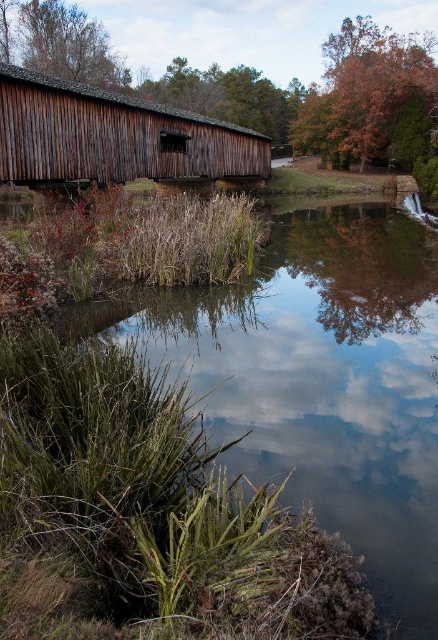
Which of these two, green grassy water at lower left or wooden bridge at left, stands taller?

wooden bridge at left is taller.

Does green grassy water at lower left have a greater height compared to wooden bridge at left?

In fact, green grassy water at lower left may be shorter than wooden bridge at left.

What do you see at coordinates (320, 381) in the screenshot? The width and height of the screenshot is (438, 640). I see `green grassy water at lower left` at bounding box center [320, 381].

Where is `green grassy water at lower left`? green grassy water at lower left is located at coordinates (320, 381).